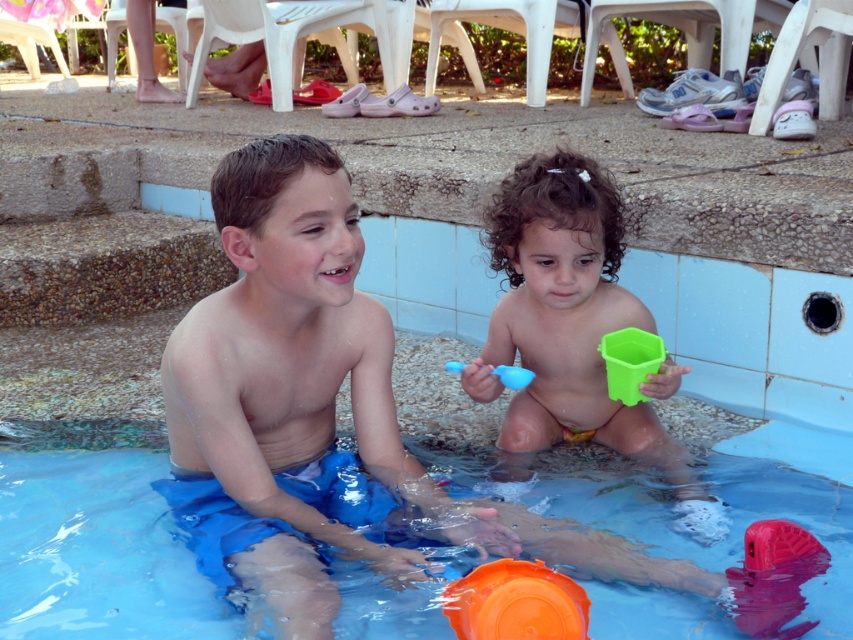
From the picture: Who is lower down, pink rubber duck at lower right or blue rubber toy at center?

Positioned lower is pink rubber duck at lower right.

This screenshot has height=640, width=853. Describe the element at coordinates (775, 577) in the screenshot. I see `pink rubber duck at lower right` at that location.

Where is `pink rubber duck at lower right`? Image resolution: width=853 pixels, height=640 pixels. pink rubber duck at lower right is located at coordinates (775, 577).

Between point (263, 292) and point (525, 369), which one is positioned in front?

Point (263, 292) is more forward.

In the scene shown: Who is shorter, blue fabric shorts at center or blue rubber toy at center?

With less height is blue rubber toy at center.

Between point (373, 320) and point (502, 381), which one is positioned in front?

Positioned in front is point (373, 320).

Identify the location of blue fabric shorts at center. The width and height of the screenshot is (853, 640). (294, 400).

Is blue fabric shorts at center to the right of pink rubber duck at lower right from the viewer's perspective?

Incorrect, blue fabric shorts at center is not on the right side of pink rubber duck at lower right.

Can you confirm if blue fabric shorts at center is taller than pink rubber duck at lower right?

Correct, blue fabric shorts at center is much taller as pink rubber duck at lower right.

Locate an element on the screen. The width and height of the screenshot is (853, 640). blue fabric shorts at center is located at coordinates (294, 400).

You are a GUI agent. You are given a task and a screenshot of the screen. Output one action in this format:
    pyautogui.click(x=<x>, y=<y>)
    Task: Click on the blue fabric shorts at center
    This screenshot has width=853, height=640.
    Given the screenshot: What is the action you would take?
    pyautogui.click(x=294, y=400)